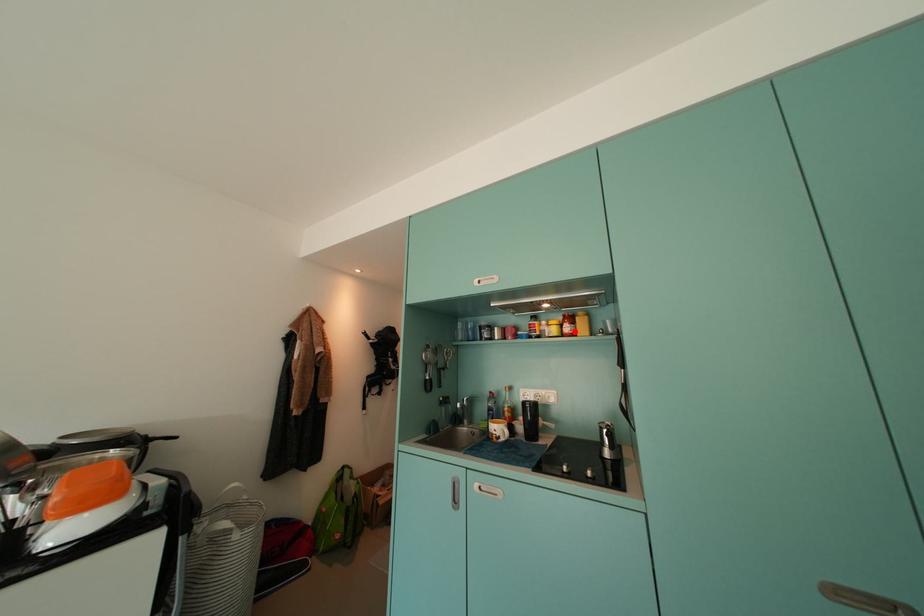
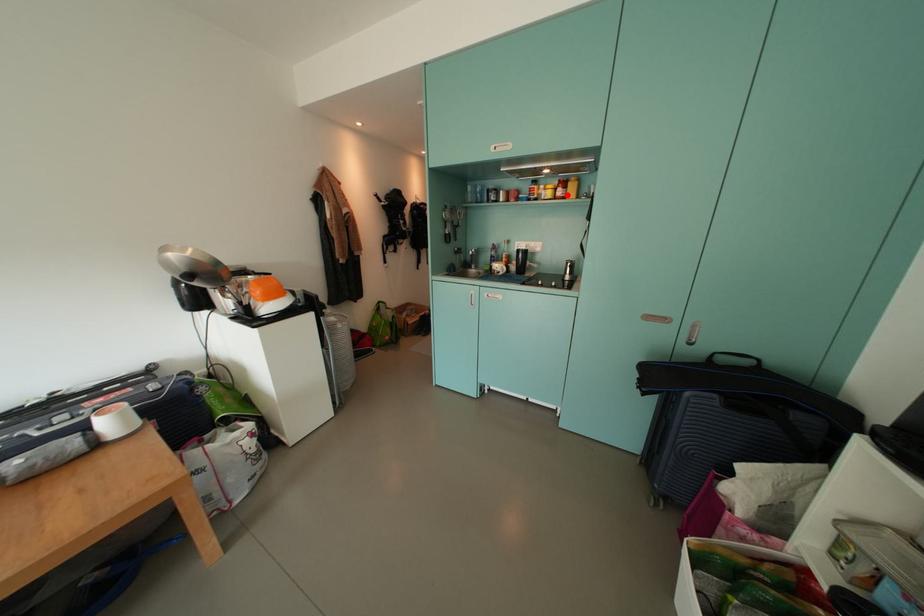
I am providing you with two images of the same scene from different viewpoints. A red point is marked on the first image and another point is marked on the second image. Is the marked point in image1 the same physical position as the marked point in image2?

Yes